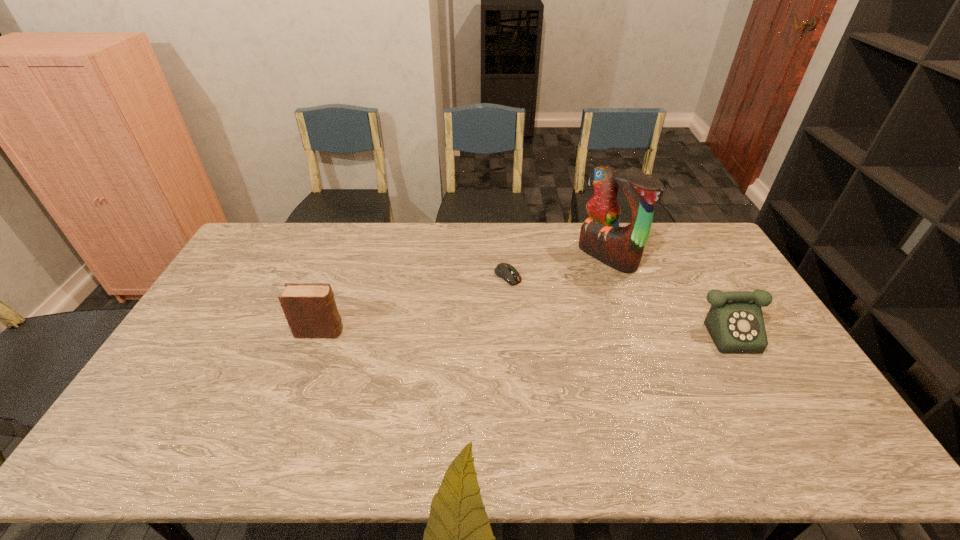
You are a GUI agent. You are given a task and a screenshot of the screen. Output one action in this format:
    pyautogui.click(x=<x>, y=<y>)
    Task: Click on the free area in between the shortest object and the rightmost object
    The height and width of the screenshot is (540, 960).
    Given the screenshot: What is the action you would take?
    pyautogui.click(x=626, y=303)

At what (x,y) coordinates should I click in order to perform the action: click on vacant space that is in between the computer equipment and the rightmost object. Please return your answer as a coordinate pair (x, y). The height and width of the screenshot is (540, 960). Looking at the image, I should click on (626, 303).

Select which object appears as the third closest to the diary. Please provide its 2D coordinates. Your answer should be formatted as a tuple, i.e. [(x, y)], where the tuple contains the x and y coordinates of a point satisfying the conditions above.

[(735, 322)]

At what (x,y) coordinates should I click in order to perform the action: click on object identified as the third closest to the tallest object. Please return your answer as a coordinate pair (x, y). Looking at the image, I should click on (310, 309).